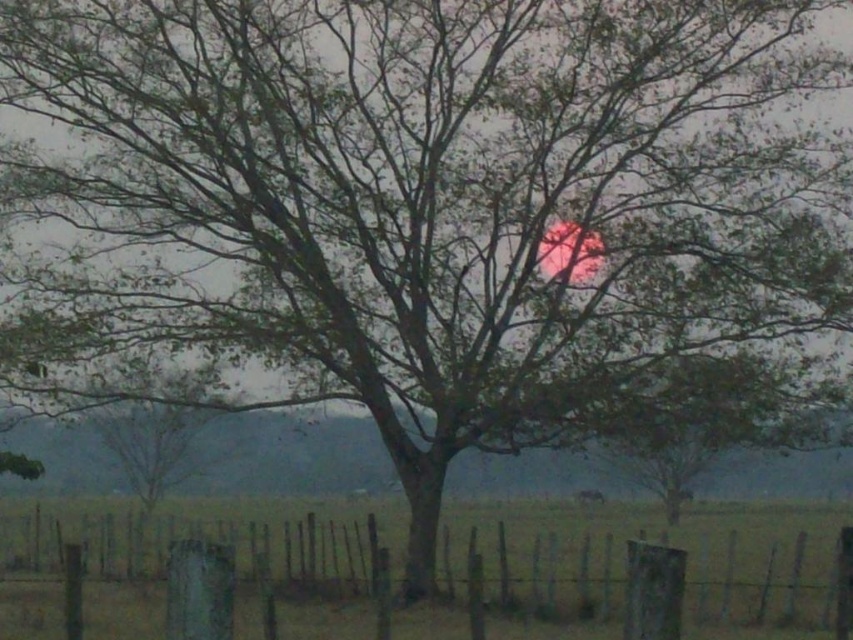
The height and width of the screenshot is (640, 853). Identify the location of wooden post fence at lower center. (625, 566).